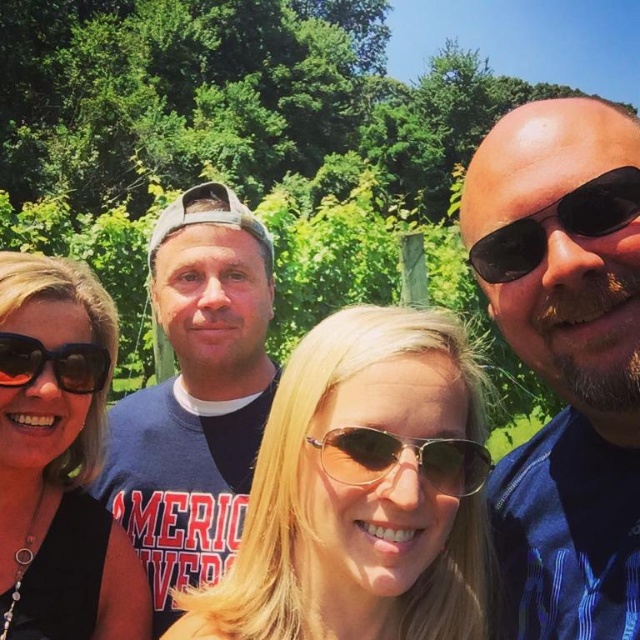
You are a photographer trying to capture a detailed closeup of the blue striped shirt at center and the black plastic sunglasses at left. Which object requires a wider angle lens to accommodate its size?

The blue striped shirt at center requires a wider angle lens because its width is larger than the black plastic sunglasses at left.

You are standing at the point labeled point (x=573, y=362) and want to walk to the point labeled point (x=163, y=406). Based on the scene, will you have to walk towards the background or towards the foreground?

Since point (x=573, y=362) is in front of point (x=163, y=406), you will have to walk towards the background to reach point (x=163, y=406).

You are standing at the origin of the coordinate system in the image. You see two points labeled as point (552, 122) and point (86, 376). Which point is closer to you?

Point (552, 122) is in front of point (86, 376), so it is closer to you.